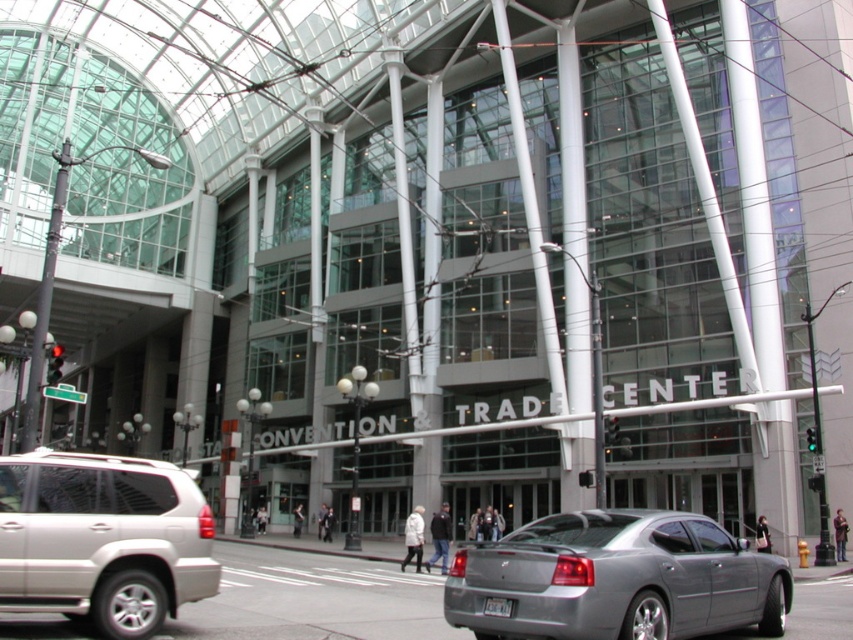
You are a delivery driver who needs to park your silver metallic sedan at center. The parking spot is located at point (614, 579). Can you park your car there?

Yes, the silver metallic sedan at center is already located at point (614, 579), so you can park there.

You are a delivery driver who needs to park your vehicle in the Convention Center parking lot. The parking lot entrance is located near the satin silver suv at lower left. Your current position is near the silver metallic sedan at center. Can you safely navigate from your current position to the parking lot entrance without moving any other vehicles?

The silver metallic sedan at center is closer to the viewer than the satin silver suv at lower left, so you can safely navigate from your current position near the silver metallic sedan at center to the parking lot entrance near the satin silver suv at lower left without moving any other vehicles.